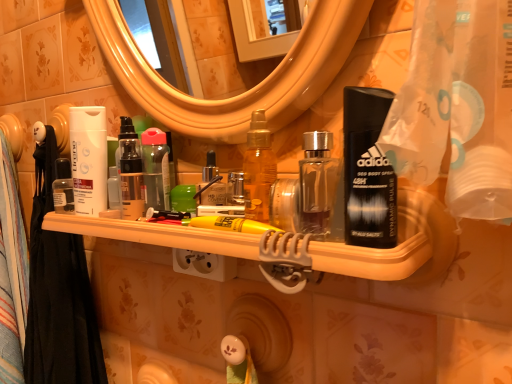
Image resolution: width=512 pixels, height=384 pixels. In order to click on blank space above translucent plastic shelf at center (from a real-world perspective) in this screenshot , I will do `click(197, 217)`.